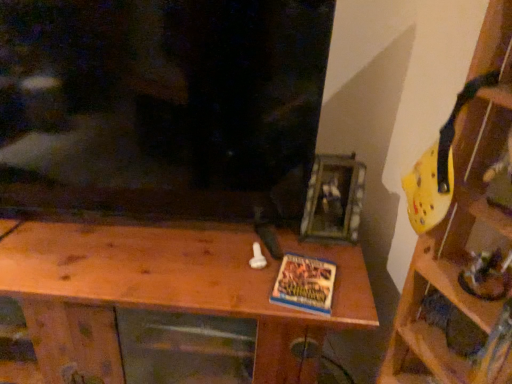
Question: Does wooden at center, positioned as the 1th shelf in left-to-right order, appear on the right side of yellow plastic helmet at upper right, the first shelf from the right?

Choices:
 (A) no
 (B) yes

Answer: (A)

Question: From a real-world perspective, is wooden at center, positioned as the 1th shelf in left-to-right order, physically above yellow plastic helmet at upper right, arranged as the second shelf when viewed from the left?

Choices:
 (A) no
 (B) yes

Answer: (A)

Question: From the image's perspective, is wooden at center, positioned as the 1th shelf in left-to-right order, above yellow plastic helmet at upper right, arranged as the second shelf when viewed from the left?

Choices:
 (A) no
 (B) yes

Answer: (A)

Question: Would you say yellow plastic helmet at upper right, the first shelf from the right, is part of wooden at center, positioned as the 1th shelf in left-to-right order,'s contents?

Choices:
 (A) yes
 (B) no

Answer: (B)

Question: Is wooden at center, which is the second shelf in right-to-left order, behind yellow plastic helmet at upper right, arranged as the second shelf when viewed from the left?

Choices:
 (A) no
 (B) yes

Answer: (B)

Question: Considering the relative sizes of wooden at center, which is the second shelf in right-to-left order, and yellow plastic helmet at upper right, arranged as the second shelf when viewed from the left, in the image provided, is wooden at center, which is the second shelf in right-to-left order, thinner than yellow plastic helmet at upper right, arranged as the second shelf when viewed from the left,?

Choices:
 (A) yes
 (B) no

Answer: (B)

Question: Can you confirm if blue matte book at center is positioned to the right of yellow plastic helmet at upper right, the first shelf from the right?

Choices:
 (A) yes
 (B) no

Answer: (B)

Question: Is blue matte book at center to the left of yellow plastic helmet at upper right, arranged as the second shelf when viewed from the left, from the viewer's perspective?

Choices:
 (A) yes
 (B) no

Answer: (A)

Question: From the image's perspective, is blue matte book at center below yellow plastic helmet at upper right, arranged as the second shelf when viewed from the left?

Choices:
 (A) yes
 (B) no

Answer: (A)

Question: Is blue matte book at center bigger than yellow plastic helmet at upper right, arranged as the second shelf when viewed from the left?

Choices:
 (A) no
 (B) yes

Answer: (A)

Question: Could yellow plastic helmet at upper right, the first shelf from the right, be considered to be inside blue matte book at center?

Choices:
 (A) yes
 (B) no

Answer: (B)

Question: Could you tell me if blue matte book at center is turned towards yellow plastic helmet at upper right, the first shelf from the right?

Choices:
 (A) yes
 (B) no

Answer: (B)

Question: From the image's perspective, is yellow plastic helmet at upper right, arranged as the second shelf when viewed from the left, located above blue matte book at center?

Choices:
 (A) no
 (B) yes

Answer: (B)